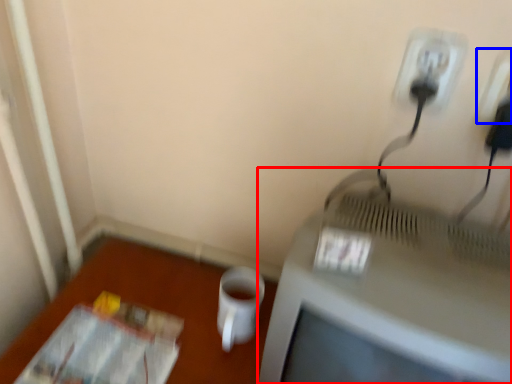
Question: Which point is further to the camera, television (highlighted by a red box) or electric outlet (highlighted by a blue box)?

Choices:
 (A) television
 (B) electric outlet

Answer: (B)